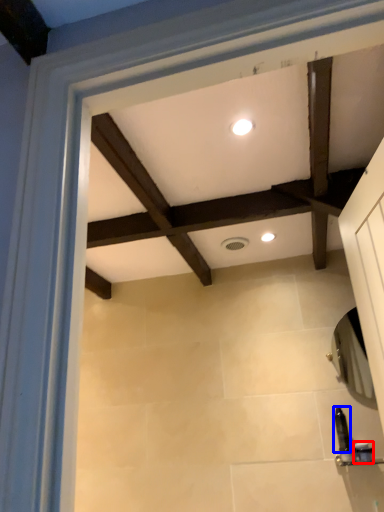
Question: Which object is further to the camera taking this photo, toiletry (highlighted by a red box) or toiletry (highlighted by a blue box)?

Choices:
 (A) toiletry
 (B) toiletry

Answer: (B)